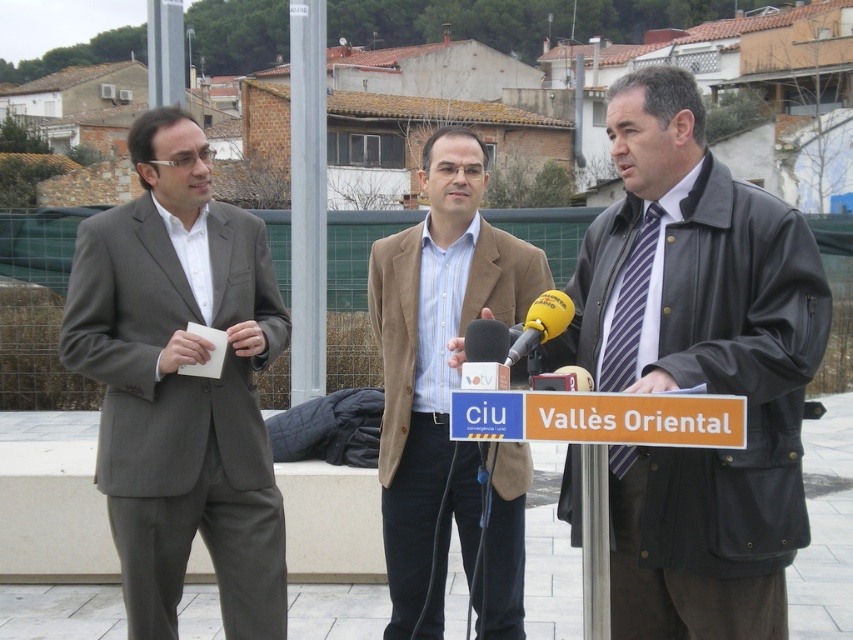
You are standing in front of the three men at the press conference. You need to determine which of the two points, point [741,278] or point [567,310], is closer to you. Which one is closer?

Point [741,278] is closer to you because it is further to the viewer than point [567,310].

You are standing at the point with coordinates point [310,100] and want to walk to the point with coordinates point [552,323]. Which direction should you move?

You should move forward because point [310,100] is behind point [552,323].

You are a photographer at a press conference. You need to capture a photo of the two men in the middle and the leather jacket at center. Which object is positioned to the right of the brown textured blazer at center?

The leather jacket at center is positioned to the right of the brown textured blazer at center.